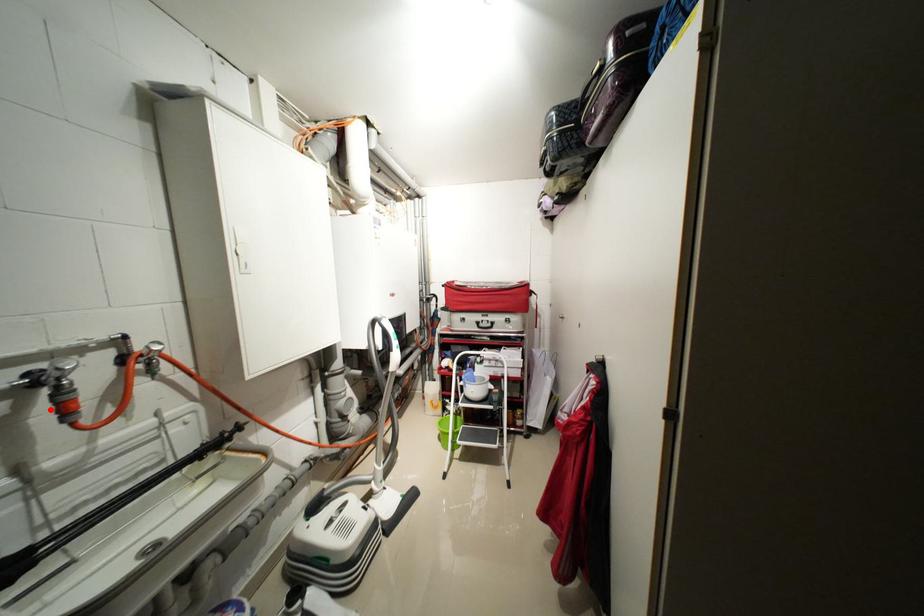
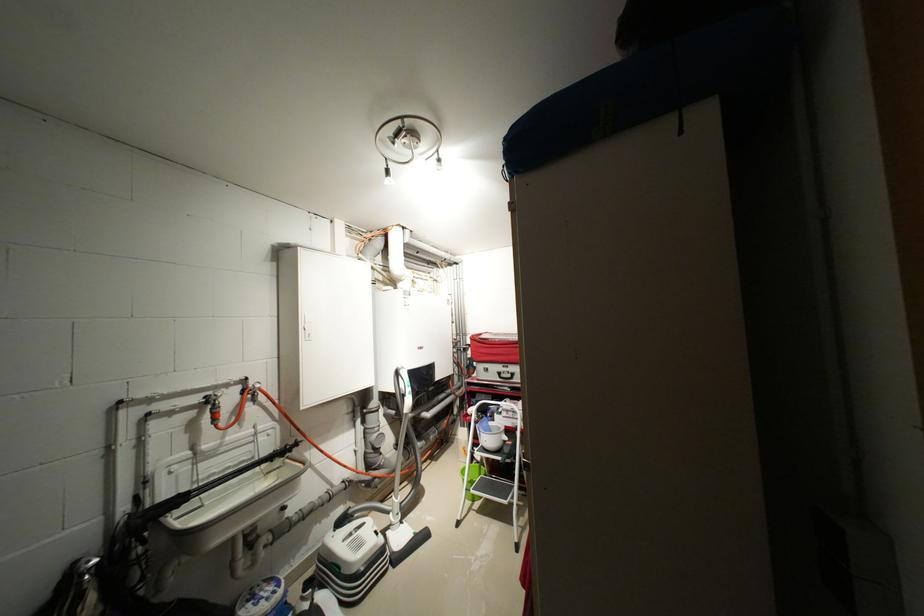
Locate, in the second image, the point that corresponds to the highlighted location in the first image.

(214, 416)